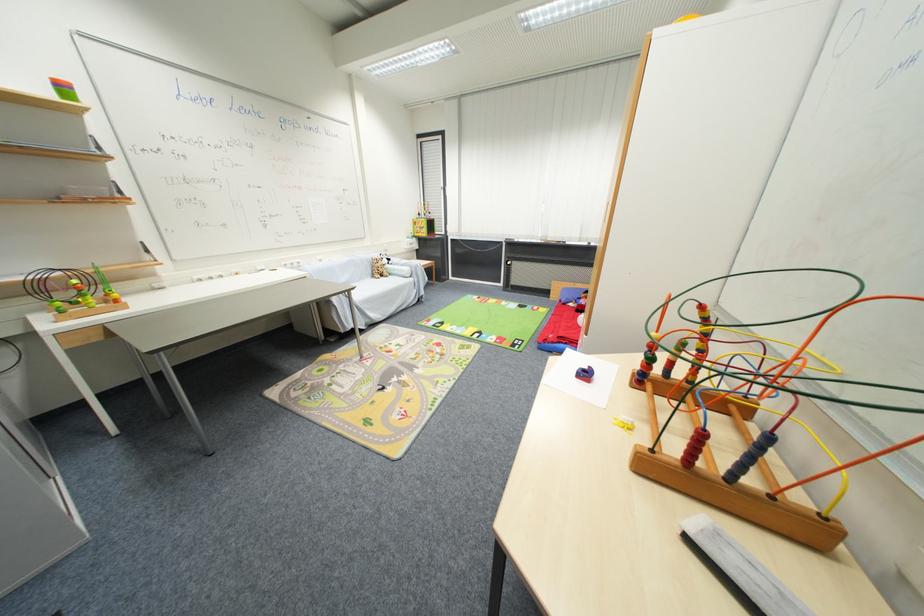
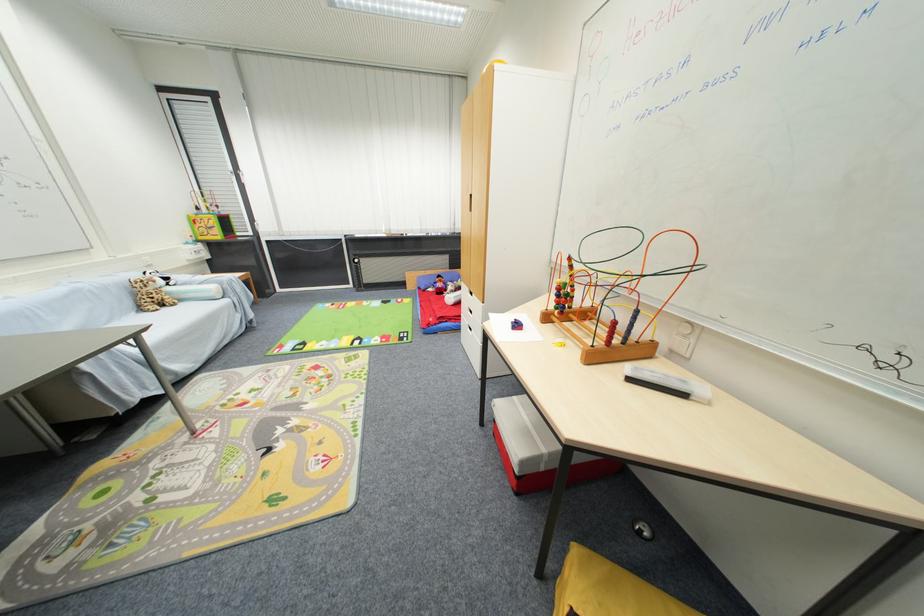
In the second image, find the point that corresponds to [379,277] in the first image.

(146, 310)